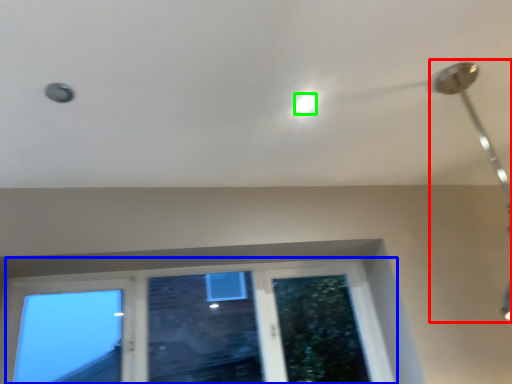
Question: Estimate the real-world distances between objects in this image. Which object is farther from lamp (highlighted by a red box), window (highlighted by a blue box) or droplight (highlighted by a green box)?

Choices:
 (A) window
 (B) droplight

Answer: (A)